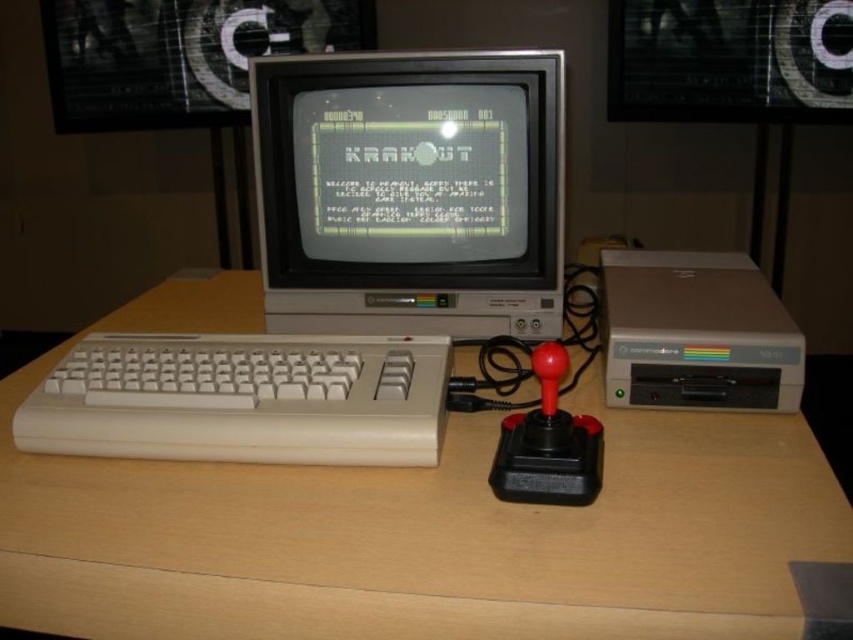
Does light brown wood at center have a larger size compared to matte gray floppy disk drive at center right?

Yes.

Who is shorter, light brown wood at center or matte gray floppy disk drive at center right?

With less height is matte gray floppy disk drive at center right.

Locate an element on the screen. The width and height of the screenshot is (853, 640). light brown wood at center is located at coordinates (424, 538).

The image size is (853, 640). I want to click on light brown wood at center, so click(424, 538).

Does gray plastic monitor at center have a greater width compared to matte gray floppy disk drive at center right?

Yes, gray plastic monitor at center is wider than matte gray floppy disk drive at center right.

Is gray plastic monitor at center further to the viewer compared to matte gray floppy disk drive at center right?

Yes, it is.

Where is `gray plastic monitor at center`? This screenshot has height=640, width=853. gray plastic monitor at center is located at coordinates pos(410,193).

Identify the location of gray plastic monitor at center. (410, 193).

Is light brown wood at center to the left of gray plastic monitor at center from the viewer's perspective?

Indeed, light brown wood at center is positioned on the left side of gray plastic monitor at center.

Who is more forward, (x=144, y=625) or (x=289, y=260)?

Positioned in front is point (x=144, y=625).

Where is `light brown wood at center`? This screenshot has width=853, height=640. light brown wood at center is located at coordinates (424, 538).